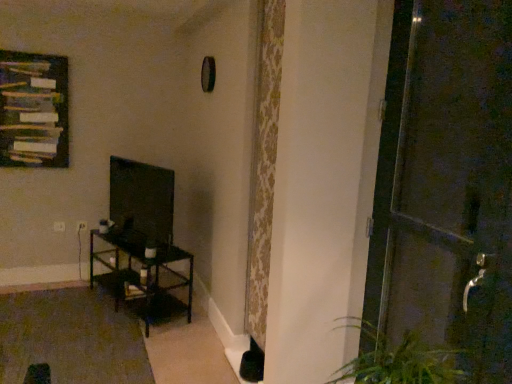
Question: From the image's perspective, is wooden frame at upper left located beneath metallic dark brown door at right?

Choices:
 (A) yes
 (B) no

Answer: (B)

Question: Is metallic dark brown door at right completely or partially inside wooden frame at upper left?

Choices:
 (A) yes
 (B) no

Answer: (B)

Question: From a real-world perspective, is wooden frame at upper left beneath metallic dark brown door at right?

Choices:
 (A) no
 (B) yes

Answer: (A)

Question: Can you confirm if wooden frame at upper left is wider than metallic dark brown door at right?

Choices:
 (A) yes
 (B) no

Answer: (B)

Question: From the image's perspective, is wooden frame at upper left on top of metallic dark brown door at right?

Choices:
 (A) yes
 (B) no

Answer: (A)

Question: From the image's perspective, is dark brown metal table at left located above or below metallic dark brown door at right?

Choices:
 (A) below
 (B) above

Answer: (A)

Question: From a real-world perspective, is dark brown metal table at left positioned above or below metallic dark brown door at right?

Choices:
 (A) below
 (B) above

Answer: (A)

Question: Considering the positions of dark brown metal table at left and metallic dark brown door at right in the image, is dark brown metal table at left bigger or smaller than metallic dark brown door at right?

Choices:
 (A) big
 (B) small

Answer: (A)

Question: Is dark brown metal table at left spatially inside metallic dark brown door at right, or outside of it?

Choices:
 (A) outside
 (B) inside

Answer: (A)

Question: Is matte black tv at left wider or thinner than dark brown metal table at left?

Choices:
 (A) wide
 (B) thin

Answer: (B)

Question: Considering their positions, is matte black tv at left located in front of or behind dark brown metal table at left?

Choices:
 (A) behind
 (B) front

Answer: (B)

Question: From a real-world perspective, is matte black tv at left positioned above or below dark brown metal table at left?

Choices:
 (A) below
 (B) above

Answer: (B)

Question: From the image's perspective, is matte black tv at left positioned above or below dark brown metal table at left?

Choices:
 (A) below
 (B) above

Answer: (B)

Question: In terms of height, does wooden frame at upper left look taller or shorter compared to matte black tv at left?

Choices:
 (A) tall
 (B) short

Answer: (A)

Question: Considering the relative positions of wooden frame at upper left and matte black tv at left in the image provided, is wooden frame at upper left to the left or to the right of matte black tv at left?

Choices:
 (A) left
 (B) right

Answer: (A)